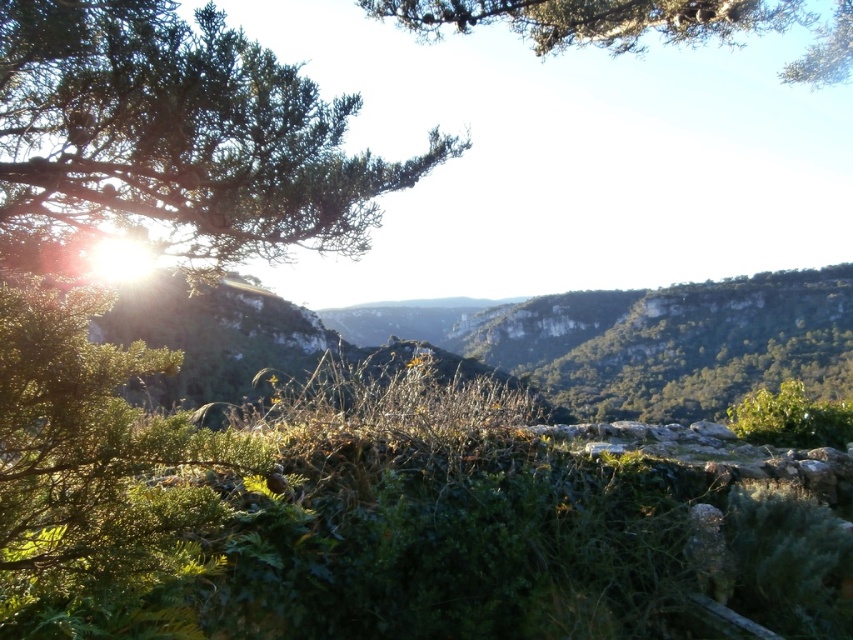
Question: Is green leafy branch at upper left below green leafy tree at upper center?

Choices:
 (A) yes
 (B) no

Answer: (A)

Question: Is green leafy branch at upper left closer to camera compared to green leafy tree at upper center?

Choices:
 (A) yes
 (B) no

Answer: (A)

Question: Which point is farther to the camera?

Choices:
 (A) (216, 65)
 (B) (677, 28)

Answer: (B)

Question: Can you confirm if green leafy branch at upper left is bigger than green leafy tree at upper center?

Choices:
 (A) yes
 (B) no

Answer: (B)